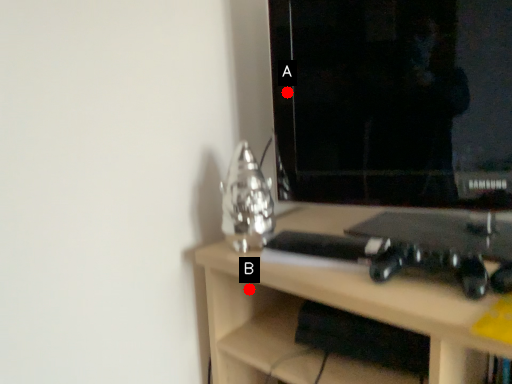
Question: Two points are circled on the image, labeled by A and B beside each circle. Which point is further to the camera?

Choices:
 (A) A is further
 (B) B is further

Answer: (B)